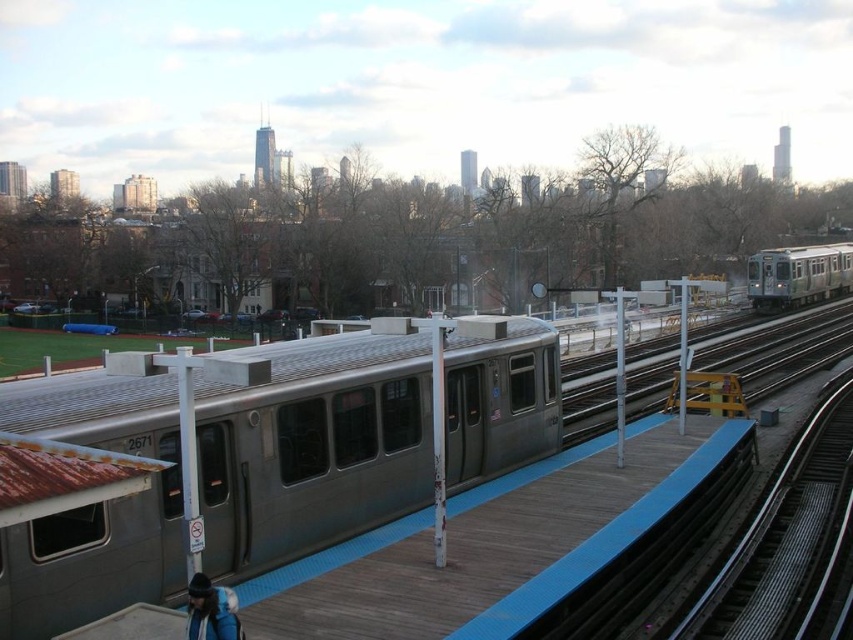
Question: Which of the following is the closest to the observer?

Choices:
 (A) (258, 440)
 (B) (828, 614)
 (C) (785, 275)

Answer: (A)

Question: Is silver metallic train at center in front of silver metallic train at right?

Choices:
 (A) yes
 (B) no

Answer: (A)

Question: Which of the following is the closest to the observer?

Choices:
 (A) smooth steel tracks at right
 (B) silver metallic train at center

Answer: (B)

Question: Is silver metallic train at center positioned in front of smooth steel tracks at right?

Choices:
 (A) yes
 (B) no

Answer: (A)

Question: Considering the relative positions of silver metallic train at center and silver metallic train at right in the image provided, where is silver metallic train at center located with respect to silver metallic train at right?

Choices:
 (A) left
 (B) right

Answer: (A)

Question: Which object is farther from the camera taking this photo?

Choices:
 (A) silver metallic train at center
 (B) smooth steel tracks at right
 (C) silver metallic train at right

Answer: (C)